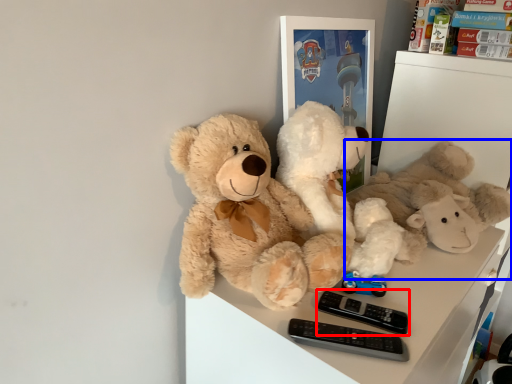
Question: Which object is closer to the camera taking this photo, control (highlighted by a red box) or teddy bear (highlighted by a blue box)?

Choices:
 (A) control
 (B) teddy bear

Answer: (A)